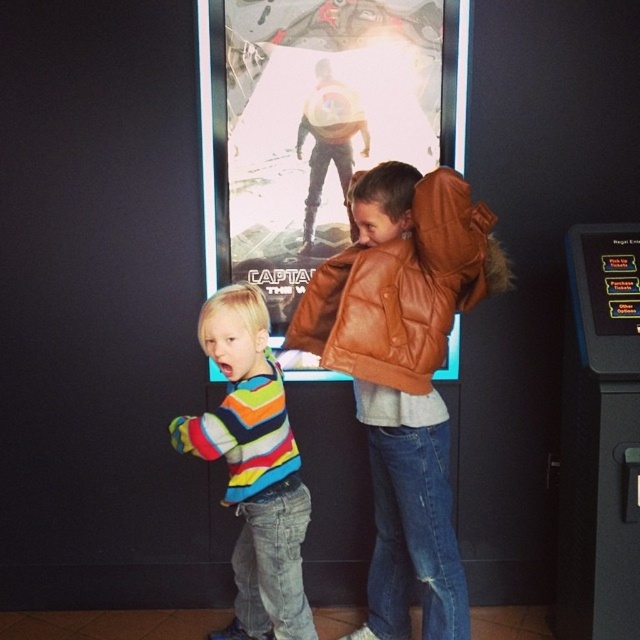
Question: Which of the following is the farthest from the observer?

Choices:
 (A) (x=326, y=138)
 (B) (x=292, y=476)
 (C) (x=634, y=492)

Answer: (A)

Question: Is brown leather jacket at center positioned before striped cotton shirt at center?

Choices:
 (A) no
 (B) yes

Answer: (B)

Question: Which of the following is the farthest from the observer?

Choices:
 (A) (570, 593)
 (B) (289, 541)
 (C) (308, 227)

Answer: (C)

Question: Where is black plastic slot machine at right located in relation to shiny metallic suit at center in the image?

Choices:
 (A) below
 (B) above

Answer: (A)

Question: Can you confirm if black plastic slot machine at right is thinner than shiny metallic suit at center?

Choices:
 (A) no
 (B) yes

Answer: (B)

Question: Which object is closer to the camera taking this photo?

Choices:
 (A) striped cotton shirt at center
 (B) shiny metallic suit at center

Answer: (A)